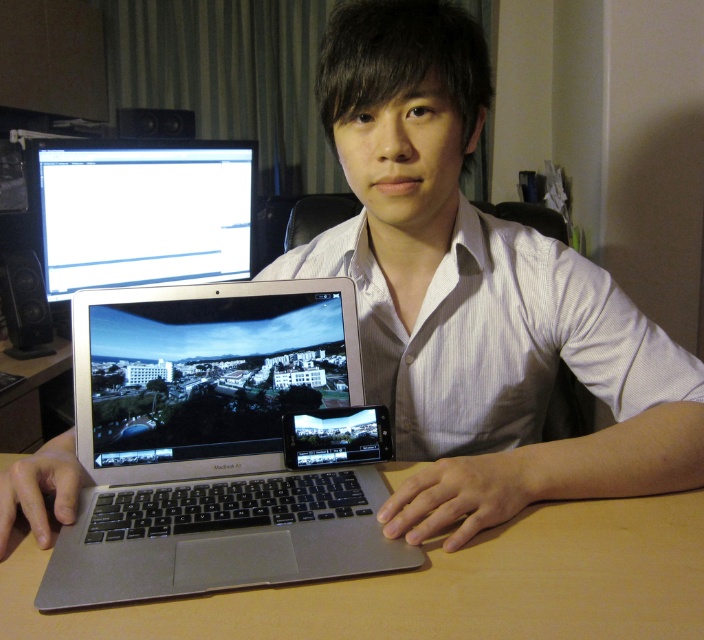
You are standing in the home office and want to place a new plant on the desk. The desk is at point (439, 586). Where exactly should you put the plant?

The brown wooden table at center is located at point (439, 586), so you should place the plant on the brown wooden table at center.

From the picture: You are setting up a presentation and need to place both the silver metallic laptop at center and the brown wooden table at center on a shelf. The shelf has limited space. Which object should you place first to ensure both fit?

The silver metallic laptop at center has a lesser width compared to the brown wooden table at center, so you should place the brown wooden table at center first to ensure both fit on the shelf.

You are setting up a presentation and need to choose between the silver metallic laptop at center and the white glossy monitor at upper left. Which device has a larger screen for displaying more content?

The white glossy monitor at upper left has a larger screen than the silver metallic laptop at center, so it can display more content.